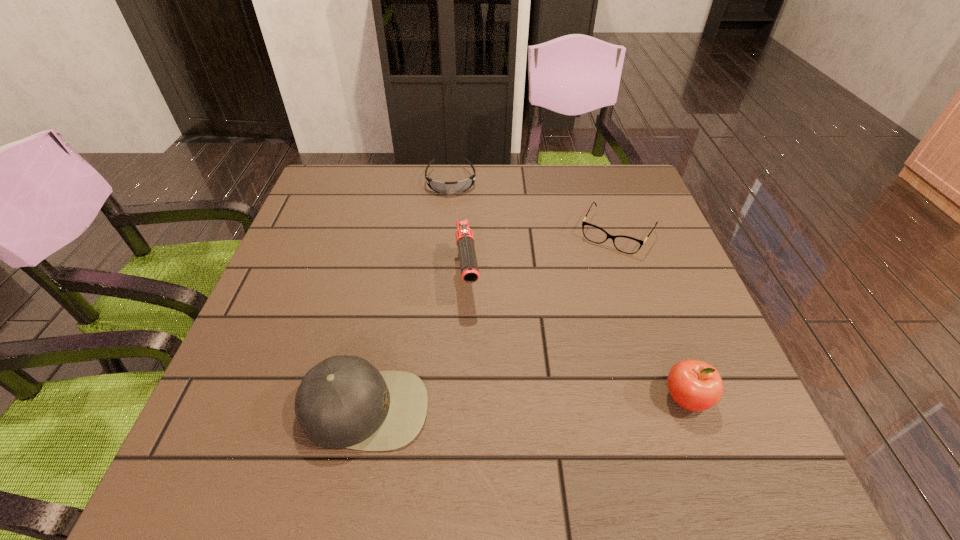
The height and width of the screenshot is (540, 960). Find the location of `empty space that is in between the apple and the cap`. empty space that is in between the apple and the cap is located at coordinates (525, 403).

At what (x,y) coordinates should I click in order to perform the action: click on vacant area that lies between the farthest object and the cap. Please return your answer as a coordinate pair (x, y). Image resolution: width=960 pixels, height=540 pixels. Looking at the image, I should click on (408, 295).

Identify the location of empty location between the cap and the apple. This screenshot has width=960, height=540. (525, 403).

This screenshot has height=540, width=960. In order to click on vacant space in between the spectacles and the sunglasses in this screenshot , I will do `click(534, 207)`.

The image size is (960, 540). In order to click on unoccupied position between the apple and the cap in this screenshot , I will do `click(525, 403)`.

Find the location of a particular element. vacant area that lies between the cap and the spectacles is located at coordinates (491, 321).

Where is `blank region between the cap and the spectacles`? Image resolution: width=960 pixels, height=540 pixels. blank region between the cap and the spectacles is located at coordinates (491, 321).

Locate an element on the screen. The image size is (960, 540). vacant point located between the spectacles and the gun is located at coordinates (542, 255).

Locate an element on the screen. the fourth closest object relative to the cap is located at coordinates (461, 186).

Identify which object is located as the nearest to the spectacles. Please provide its 2D coordinates. Your answer should be formatted as a tuple, i.e. [(x, y)], where the tuple contains the x and y coordinates of a point satisfying the conditions above.

[(465, 242)]